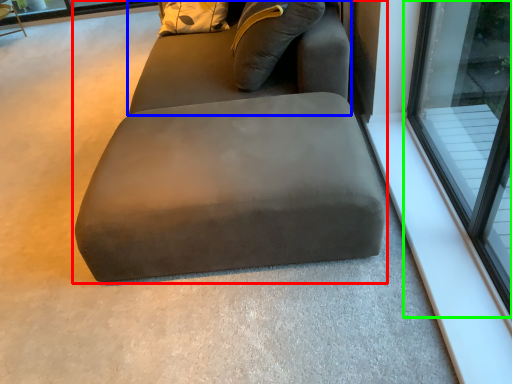
Question: Estimate the real-world distances between objects in this image. Which object is closer to studio couch (highlighted by a red box), bean bag chair (highlighted by a blue box) or window (highlighted by a green box)?

Choices:
 (A) bean bag chair
 (B) window

Answer: (A)